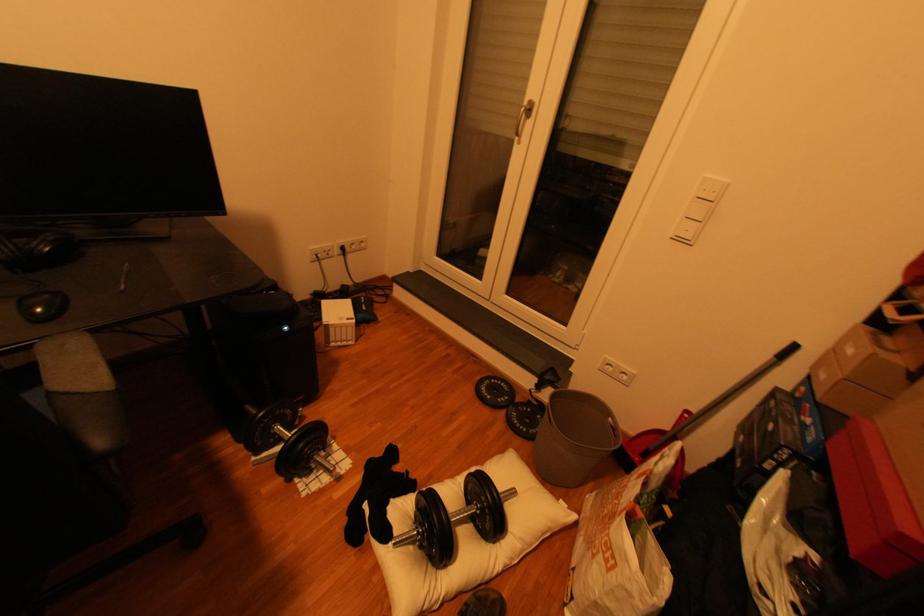
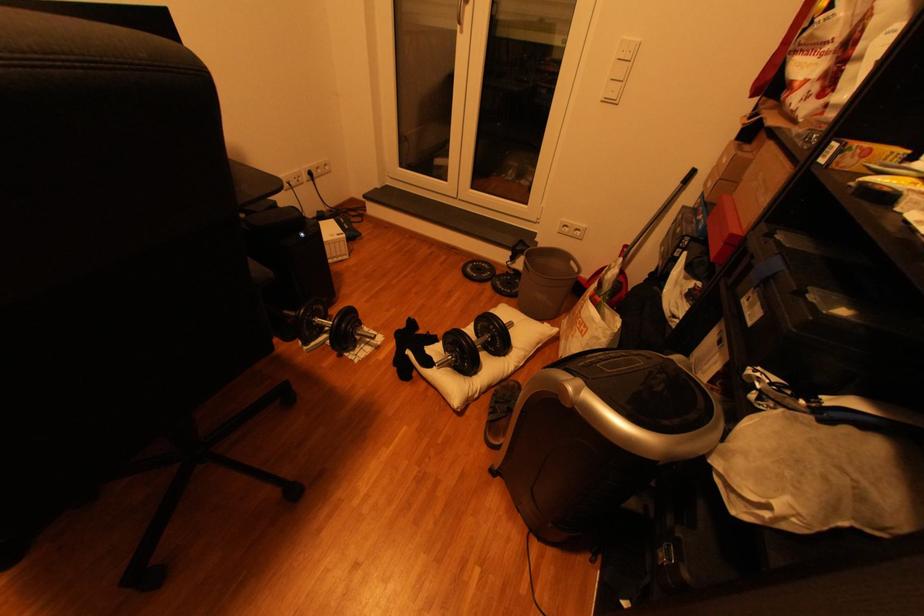
Question: How did the camera likely rotate?

Choices:
 (A) Left
 (B) Right
 (C) Up
 (D) Down

Answer: (D)